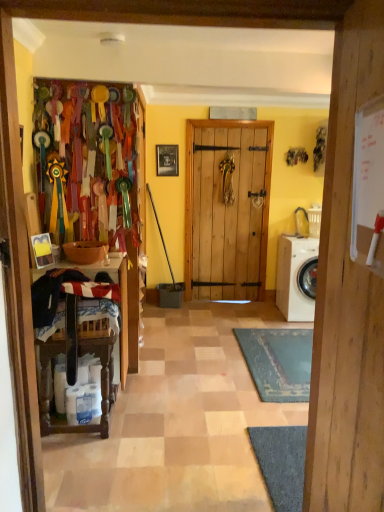
Question: From a real-world perspective, relative to white matte washing machine at right, is wooden door at center vertically above or below?

Choices:
 (A) below
 (B) above

Answer: (B)

Question: Would you say wooden door at center is inside or outside white matte washing machine at right?

Choices:
 (A) inside
 (B) outside

Answer: (B)

Question: Which of these objects is positioned farthest from the white matte washing machine at right?

Choices:
 (A) wooden frame at center
 (B) wooden door at center

Answer: (B)

Question: Which object is the farthest from the wooden door at center?

Choices:
 (A) wooden frame at center
 (B) white matte washing machine at right

Answer: (A)